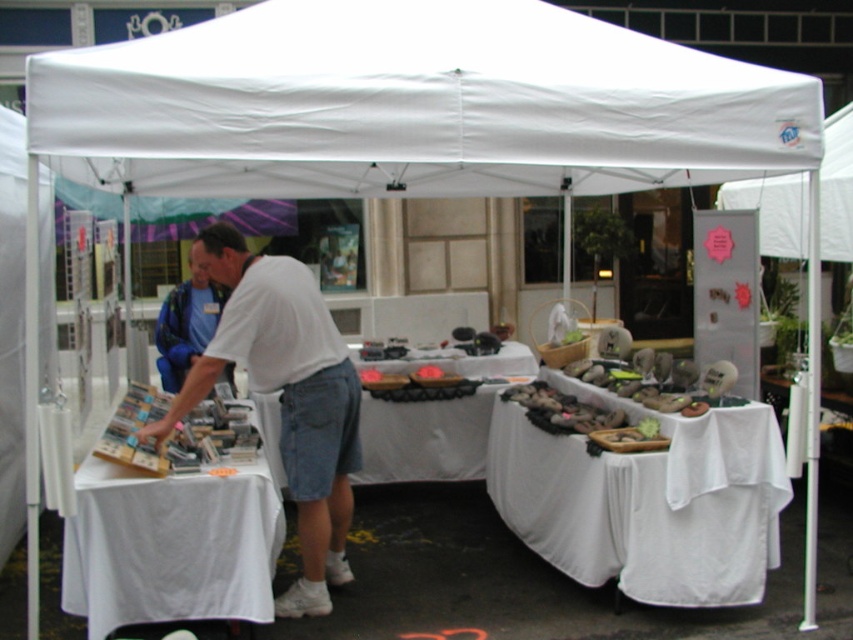
Does point (309, 436) come behind point (200, 493)?

Yes.

Does point (344, 365) come behind point (161, 620)?

Yes, point (344, 365) is behind point (161, 620).

Where is `white cotton shirt at center`? white cotton shirt at center is located at coordinates (285, 397).

Is white fabric table at center further to camera compared to blue fabric shirt at center?

Yes.

Is white fabric table at center to the right of blue fabric shirt at center from the viewer's perspective?

Correct, you'll find white fabric table at center to the right of blue fabric shirt at center.

Does point (488, 385) come farther from viewer compared to point (178, 381)?

Yes, it is.

This screenshot has width=853, height=640. Find the location of `white fabric table at center`. white fabric table at center is located at coordinates (424, 438).

Between white fabric canopy at upper center and white cloth-covered table at center, which one appears on the right side from the viewer's perspective?

Positioned to the right is white cloth-covered table at center.

The width and height of the screenshot is (853, 640). What do you see at coordinates (413, 106) in the screenshot?
I see `white fabric canopy at upper center` at bounding box center [413, 106].

Is point (796, 108) more distant than point (712, 442)?

That is False.

I want to click on white fabric canopy at upper center, so pos(413,106).